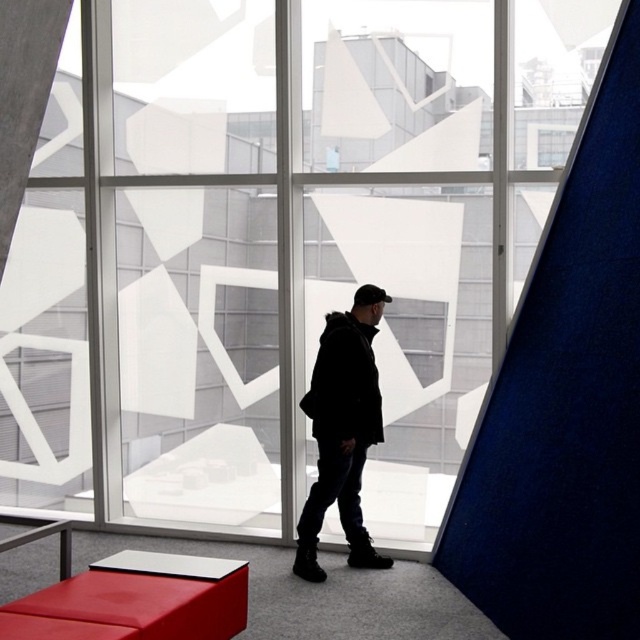
Question: Is black matte jacket at center further to camera compared to smooth leather stool at lower left?

Choices:
 (A) yes
 (B) no

Answer: (A)

Question: Does black matte jacket at center have a greater width compared to smooth leather stool at lower left?

Choices:
 (A) yes
 (B) no

Answer: (B)

Question: Among these objects, which one is farthest from the camera?

Choices:
 (A) black matte jacket at center
 (B) black matte baseball hat at center
 (C) smooth leather stool at lower left

Answer: (B)

Question: Which is farther from the black matte jacket at center?

Choices:
 (A) black matte baseball hat at center
 (B) smooth leather stool at lower left

Answer: (B)

Question: Which of the following is the farthest from the observer?

Choices:
 (A) smooth leather stool at lower left
 (B) black matte baseball hat at center

Answer: (B)

Question: Observing the image, what is the correct spatial positioning of smooth leather stool at lower left in reference to black matte baseball hat at center?

Choices:
 (A) left
 (B) right

Answer: (A)